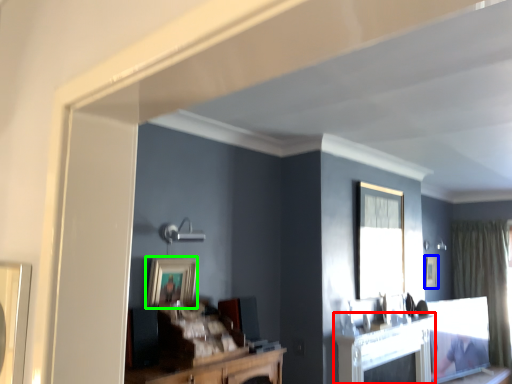
Question: Estimate the real-world distances between objects in this image. Which object is farther from fireplace (highlighted by a red box), picture frame (highlighted by a blue box) or picture frame (highlighted by a green box)?

Choices:
 (A) picture frame
 (B) picture frame

Answer: (A)